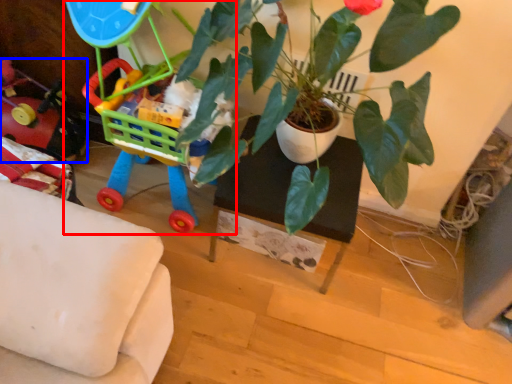
Question: Which point is closer to the camera, toy (highlighted by a red box) or toy (highlighted by a blue box)?

Choices:
 (A) toy
 (B) toy

Answer: (A)